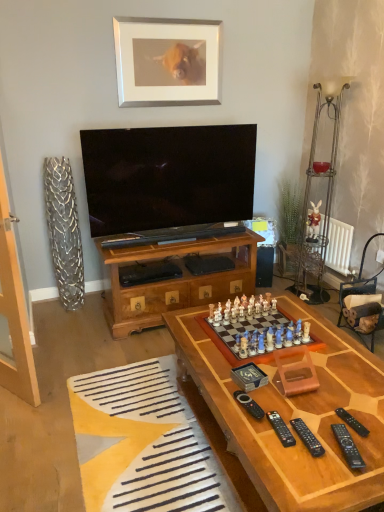
Where is `free space behind black plastic remote at lower right, the fourth remote when ordered from left to right`? free space behind black plastic remote at lower right, the fourth remote when ordered from left to right is located at coordinates (327, 414).